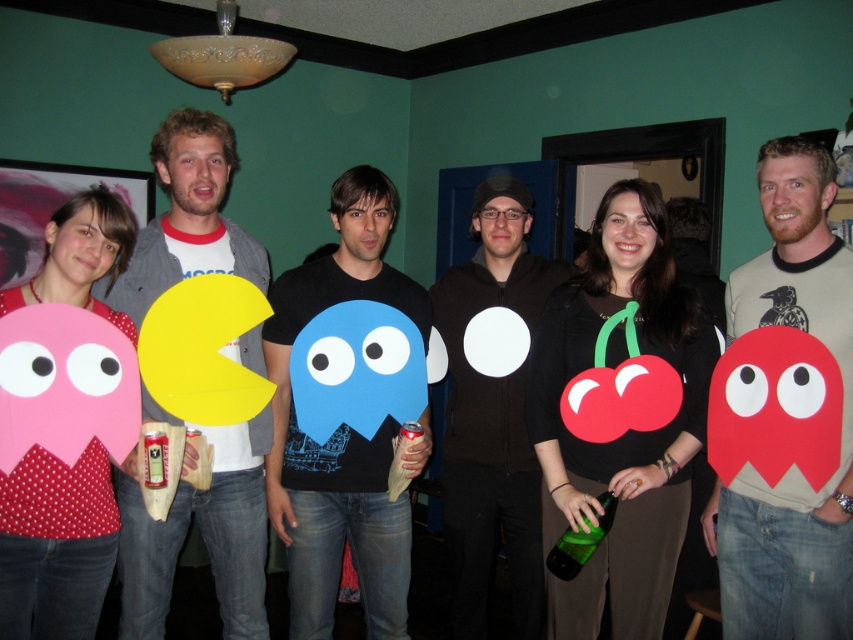
Who is shorter, blue matte t-shirt at center or black matte circle at center?

A: With less height is blue matte t-shirt at center.

Image resolution: width=853 pixels, height=640 pixels. Describe the element at coordinates (340, 429) in the screenshot. I see `blue matte t-shirt at center` at that location.

Where is `blue matte t-shirt at center`? The image size is (853, 640). blue matte t-shirt at center is located at coordinates (340, 429).

Which is below, matte gray t-shirt at center or blue matte t-shirt at center?

blue matte t-shirt at center is below.

Is matte gray t-shirt at center thinner than blue matte t-shirt at center?

Correct, matte gray t-shirt at center's width is less than blue matte t-shirt at center's.

You are a GUI agent. You are given a task and a screenshot of the screen. Output one action in this format:
    pyautogui.click(x=<x>, y=<y>)
    Task: Click on the matte gray t-shirt at center
    
    Given the screenshot: What is the action you would take?
    pyautogui.click(x=792, y=467)

At what (x,y) coordinates should I click in order to perform the action: click on matte gray t-shirt at center. Please return your answer as a coordinate pair (x, y). Looking at the image, I should click on (792, 467).

Can you confirm if matte gray t-shirt at center is positioned below matte yellow paper at left?

Correct, matte gray t-shirt at center is located below matte yellow paper at left.

Measure the distance from matte gray t-shirt at center to matte yellow paper at left.

A distance of 1.23 meters exists between matte gray t-shirt at center and matte yellow paper at left.

Image resolution: width=853 pixels, height=640 pixels. Identify the location of matte gray t-shirt at center. (792, 467).

This screenshot has width=853, height=640. In order to click on matte gray t-shirt at center in this screenshot , I will do `click(792, 467)`.